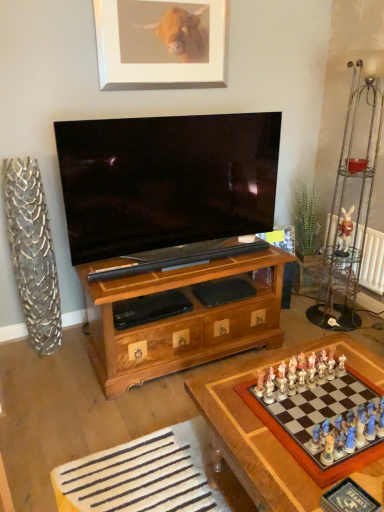
What do you see at coordinates (344, 233) in the screenshot? The image size is (384, 512). I see `white ceramic rabbit at upper right` at bounding box center [344, 233].

Describe the element at coordinates (161, 44) in the screenshot. I see `silver metallic picture frame at upper center` at that location.

Identify the location of white ceramic rabbit at upper right. This screenshot has width=384, height=512. (344, 233).

Is silver metallic picture frame at upper center wider than wooden chessboard at lower right?

Incorrect, the width of silver metallic picture frame at upper center does not surpass that of wooden chessboard at lower right.

This screenshot has height=512, width=384. What are the coordinates of `table in front of the silver metallic picture frame at upper center` in the screenshot? It's located at (267, 426).

Is silver metallic picture frame at upper center oriented away from wooden chessboard at lower right?

silver metallic picture frame at upper center is not turned away from wooden chessboard at lower right.

Is white radiator at right wider or thinner than wooden chessboard at lower right?

Considering their sizes, white radiator at right looks slimmer than wooden chessboard at lower right.

Is white radiator at right placed right next to wooden chessboard at lower right?

No, white radiator at right is not with wooden chessboard at lower right.

In terms of size, does white radiator at right appear bigger or smaller than wooden chessboard at lower right?

Clearly, white radiator at right is smaller in size than wooden chessboard at lower right.

From a real-world perspective, is white radiator at right positioned above or below wooden chessboard at lower right?

white radiator at right is situated higher than wooden chessboard at lower right in the real world.

Can white radiator at right be found inside silver metallic picture frame at upper center?

No.

Which object is further away from the camera taking this photo, silver metallic picture frame at upper center or white radiator at right?

white radiator at right is behind.

In the scene shown: Could you tell me if silver metallic picture frame at upper center is facing white radiator at right?

No, silver metallic picture frame at upper center is not oriented towards white radiator at right.

In the scene shown: Is wooden chessboard at lower right to the right of silver metallic picture frame at upper center from the viewer's perspective?

Yes.

How much distance is there between wooden chessboard at lower right and silver metallic picture frame at upper center?

They are 1.87 meters apart.

Is wooden chessboard at lower right not close to silver metallic picture frame at upper center?

Yes.

The image size is (384, 512). In order to click on picture frame positioned vertically above the wooden chessboard at lower right (from a real-world perspective) in this screenshot , I will do `click(161, 44)`.

Is white radiator at right turned away from silver metallic picture frame at upper center?

No.

At what (x,y) coordinates should I click in order to perform the action: click on radiator behind the silver metallic picture frame at upper center. Please return your answer as a coordinate pair (x, y). The height and width of the screenshot is (512, 384). Looking at the image, I should click on (373, 262).

Considering the positions of objects white radiator at right and silver metallic picture frame at upper center in the image provided, who is more to the left, white radiator at right or silver metallic picture frame at upper center?

silver metallic picture frame at upper center.

From the image's perspective, relative to silver metallic picture frame at upper center, is white radiator at right above or below?

Based on their image positions, white radiator at right is located beneath silver metallic picture frame at upper center.

From the image's perspective, is wooden chessboard at lower right on top of white radiator at right?

No, from the image's perspective, wooden chessboard at lower right is not over white radiator at right.

Is wooden chessboard at lower right in front of or behind white radiator at right in the image?

Visually, wooden chessboard at lower right is located in front of white radiator at right.

Is wooden chessboard at lower right aimed at white radiator at right?

No, wooden chessboard at lower right is not aimed at white radiator at right.

Does wooden chessboard at lower right have a larger size compared to white radiator at right?

Yes, wooden chessboard at lower right is bigger than white radiator at right.

From a real-world perspective, is white ceramic rabbit at upper right above or below white radiator at right?

From a real-world perspective, white ceramic rabbit at upper right is physically above white radiator at right.

Find the location of a particular element. The image size is (384, 512). radiator that is below the white ceramic rabbit at upper right (from the image's perspective) is located at coordinates (373, 262).

Considering the relative sizes of white ceramic rabbit at upper right and white radiator at right in the image provided, is white ceramic rabbit at upper right bigger than white radiator at right?

No.

Between white ceramic rabbit at upper right and white radiator at right, which one has more height?

Standing taller between the two is white radiator at right.

Find the location of a particular element. This screenshot has height=512, width=384. table on the right of silver metallic picture frame at upper center is located at coordinates (267, 426).

You are a GUI agent. You are given a task and a screenshot of the screen. Output one action in this format:
    pyautogui.click(x=<x>, y=<y>)
    Task: Click on the table lying on the left of white radiator at right
    
    Given the screenshot: What is the action you would take?
    pyautogui.click(x=267, y=426)

Which object lies further to the anchor point white ceramic rabbit at upper right, white radiator at right or silver metallic picture frame at upper center?

silver metallic picture frame at upper center lies further to white ceramic rabbit at upper right than the other object.

Estimate the real-world distances between objects in this image. Which object is closer to silver metallic picture frame at upper center, white ceramic rabbit at upper right or wooden chessboard at lower right?

white ceramic rabbit at upper right.

Estimate the real-world distances between objects in this image. Which object is further from silver metallic picture frame at upper center, wooden chessboard at lower right or white radiator at right?

Among the two, wooden chessboard at lower right is located further to silver metallic picture frame at upper center.

Looking at the image, which one is located closer to wooden chessboard at lower right, white radiator at right or white ceramic rabbit at upper right?

Among the two, white radiator at right is located nearer to wooden chessboard at lower right.

Considering their positions, is silver metallic picture frame at upper center positioned further to wooden chessboard at lower right than white ceramic rabbit at upper right?

silver metallic picture frame at upper center is positioned further to the anchor wooden chessboard at lower right.

When comparing their distances from white radiator at right, does silver metallic picture frame at upper center or wooden chessboard at lower right seem further?

Based on the image, silver metallic picture frame at upper center appears to be further to white radiator at right.

Which object lies further to the anchor point white radiator at right, white ceramic rabbit at upper right or silver metallic picture frame at upper center?

silver metallic picture frame at upper center is positioned further to the anchor white radiator at right.

From the image, which object appears to be farther from white ceramic rabbit at upper right, white radiator at right or wooden chessboard at lower right?

wooden chessboard at lower right.

The image size is (384, 512). In order to click on toy between wooden chessboard at lower right and white radiator at right along the z-axis in this screenshot , I will do `click(344, 233)`.

Locate an element on the screen. This screenshot has height=512, width=384. radiator between silver metallic picture frame at upper center and wooden chessboard at lower right from top to bottom is located at coordinates (373, 262).

Image resolution: width=384 pixels, height=512 pixels. In order to click on toy between silver metallic picture frame at upper center and white radiator at right in the horizontal direction in this screenshot , I will do `click(344, 233)`.

What are the coordinates of `toy between silver metallic picture frame at upper center and wooden chessboard at lower right in the vertical direction` in the screenshot? It's located at (344, 233).